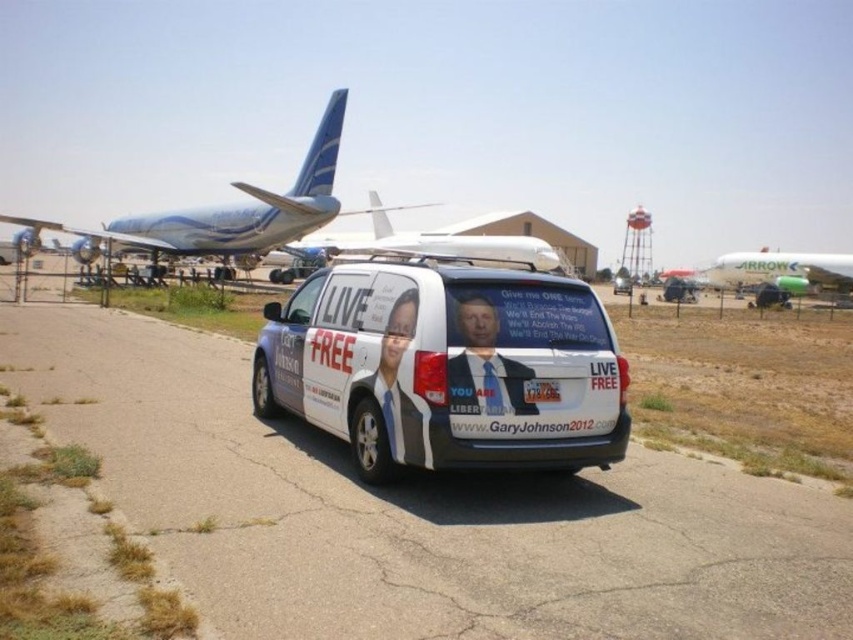
Question: Does white matte airplane at center appear on the left side of green painted fuselage airplane at center?

Choices:
 (A) yes
 (B) no

Answer: (A)

Question: Estimate the real-world distances between objects in this image. Which object is closer to the white glossy van at center?

Choices:
 (A) white glossy airplane at upper left
 (B) white matte van at center
 (C) matte black suit at center

Answer: (C)

Question: Can you confirm if white asphalt tarmac at center is positioned above green painted fuselage airplane at center?

Choices:
 (A) no
 (B) yes

Answer: (A)

Question: Is white asphalt tarmac at center positioned before white matte van at center?

Choices:
 (A) yes
 (B) no

Answer: (A)

Question: Which object is the closest to the white matte airplane at center?

Choices:
 (A) white glossy airplane at upper left
 (B) green painted fuselage airplane at center
 (C) white asphalt tarmac at center
 (D) matte black suit at center

Answer: (A)

Question: Which object appears farthest from the camera in this image?

Choices:
 (A) white glossy airplane at upper left
 (B) white matte van at center
 (C) white asphalt tarmac at center
 (D) white glossy van at center

Answer: (A)